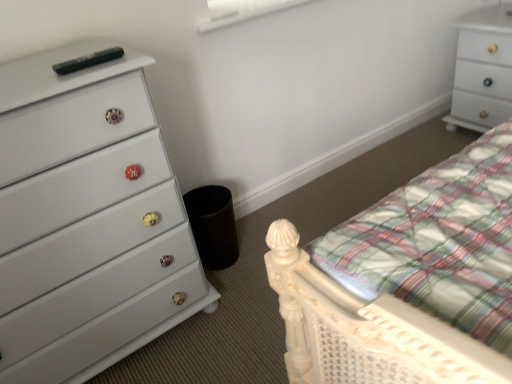
Question: From the image's perspective, does white glossy chest of drawers at upper right, which ranks as the 1th chest of drawers in right-to-left order, appear higher than white matte window screen at upper center?

Choices:
 (A) no
 (B) yes

Answer: (A)

Question: Is white glossy chest of drawers at upper right, which ranks as the second chest of drawers in bottom-to-top order, further to the viewer compared to white matte window screen at upper center?

Choices:
 (A) no
 (B) yes

Answer: (B)

Question: From a real-world perspective, is white glossy chest of drawers at upper right, the 2th chest of drawers from the left, positioned over white matte window screen at upper center based on gravity?

Choices:
 (A) yes
 (B) no

Answer: (B)

Question: Is white glossy chest of drawers at upper right, arranged as the 1th chest of drawers when viewed from the top, to the left of white matte window screen at upper center from the viewer's perspective?

Choices:
 (A) no
 (B) yes

Answer: (A)

Question: From a real-world perspective, is white glossy chest of drawers at upper right, arranged as the 1th chest of drawers when viewed from the top, positioned under white matte window screen at upper center based on gravity?

Choices:
 (A) yes
 (B) no

Answer: (A)

Question: Considering the relative sizes of white glossy chest of drawers at upper right, which ranks as the second chest of drawers in bottom-to-top order, and white matte window screen at upper center in the image provided, is white glossy chest of drawers at upper right, which ranks as the second chest of drawers in bottom-to-top order, wider than white matte window screen at upper center?

Choices:
 (A) yes
 (B) no

Answer: (A)

Question: Can you confirm if white glossy chest of drawers at left, acting as the first chest of drawers starting from the front, is positioned to the right of white matte window screen at upper center?

Choices:
 (A) yes
 (B) no

Answer: (B)

Question: From a real-world perspective, does white glossy chest of drawers at left, the first chest of drawers positioned from the left, sit lower than white matte window screen at upper center?

Choices:
 (A) yes
 (B) no

Answer: (A)

Question: Is white glossy chest of drawers at left, which is the second chest of drawers in back-to-front order, behind white matte window screen at upper center?

Choices:
 (A) yes
 (B) no

Answer: (B)

Question: Considering the relative sizes of white glossy chest of drawers at left, marked as the second chest of drawers in a top-to-bottom arrangement, and white matte window screen at upper center in the image provided, is white glossy chest of drawers at left, marked as the second chest of drawers in a top-to-bottom arrangement, thinner than white matte window screen at upper center?

Choices:
 (A) yes
 (B) no

Answer: (B)

Question: Would you say white glossy chest of drawers at left, marked as the second chest of drawers in a top-to-bottom arrangement, contains white matte window screen at upper center?

Choices:
 (A) yes
 (B) no

Answer: (B)

Question: Does white glossy chest of drawers at upper right, the 2th chest of drawers from the left, contain white glossy chest of drawers at left, which is the 1th chest of drawers from bottom to top?

Choices:
 (A) yes
 (B) no

Answer: (B)